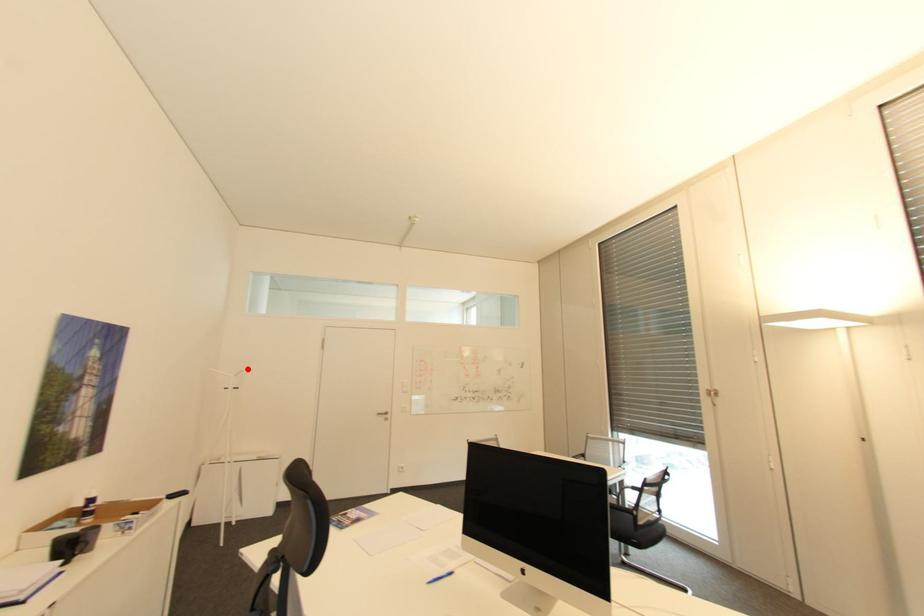
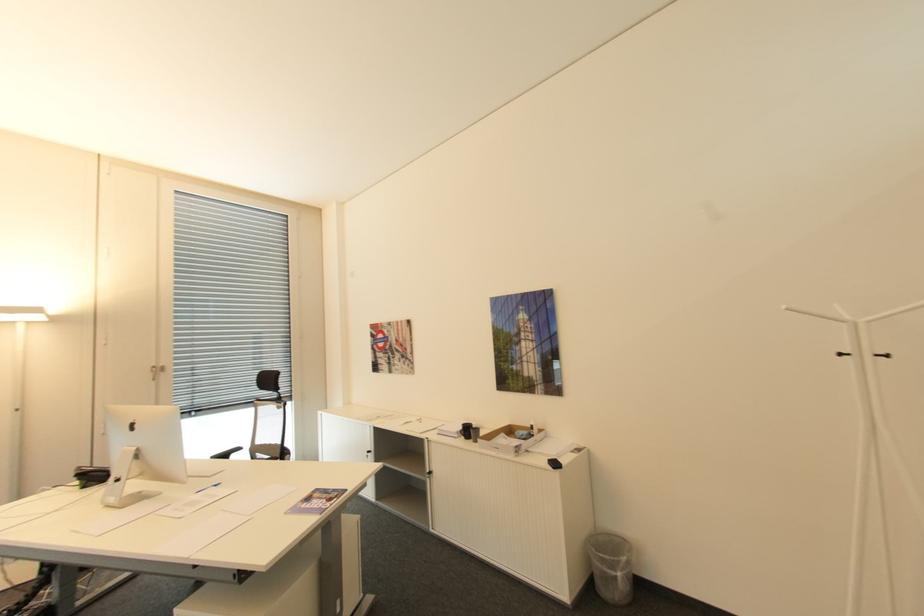
Find the pixel in the second image that matches the highlighted location in the first image.

(791, 307)